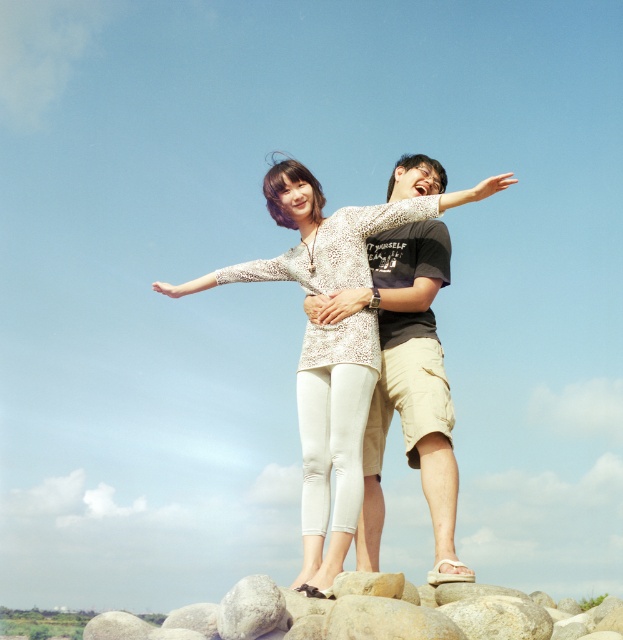
You are a photographer trying to capture a closeup of the white lace blouse at center and the smooth gray rock at lower center. Since you want both subjects to be in focus, which one should you focus on first?

The smooth gray rock at lower center is larger than the white lace blouse at center, so focusing on the larger object first will ensure both are in focus.

You are a photographer trying to capture the scene with the white lace blouse at center and the smooth gray rock at lower center. Which object is closer to the camera?

The white lace blouse at center is closer to the camera because the smooth gray rock at lower center is behind it.